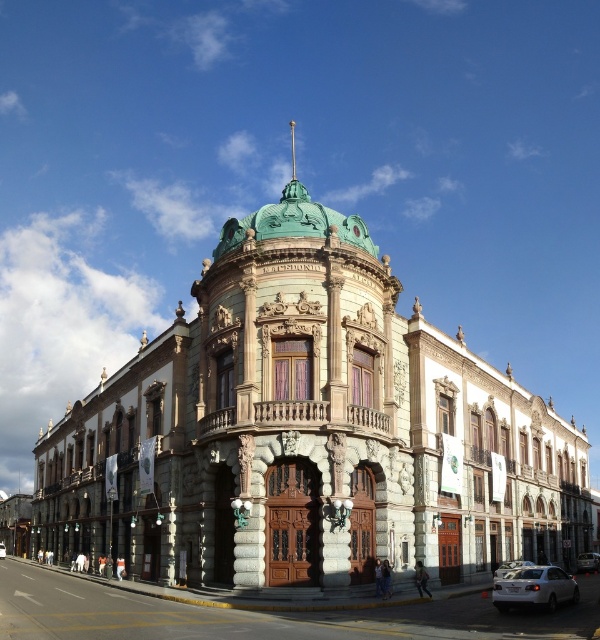
Question: Can you confirm if satin silver sedan at center is wider than white glossy sedan at center?

Choices:
 (A) no
 (B) yes

Answer: (A)

Question: Which point is closer to the camera taking this photo?

Choices:
 (A) (1, 547)
 (B) (496, 579)

Answer: (B)

Question: Can you confirm if white matte sedan at lower right is bigger than satin silver sedan at center?

Choices:
 (A) no
 (B) yes

Answer: (A)

Question: Considering the relative positions of white glossy sedan at center and white glossy car at center in the image provided, where is white glossy sedan at center located with respect to white glossy car at center?

Choices:
 (A) right
 (B) left

Answer: (A)

Question: Considering the real-world distances, which object is closest to the white glossy car at center?

Choices:
 (A) satin silver sedan at center
 (B) white matte sedan at lower right
 (C) white glossy sedan at center

Answer: (C)

Question: Which of the following is the farthest from the observer?

Choices:
 (A) satin silver sedan at center
 (B) white glossy car at center
 (C) white glossy sedan at center

Answer: (B)